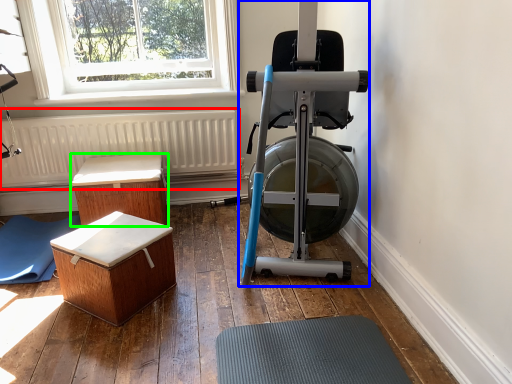
Question: Which is nearer to the radiator (highlighted by a red box)? stationary bicycle (highlighted by a blue box) or furniture (highlighted by a green box).

Choices:
 (A) stationary bicycle
 (B) furniture

Answer: (B)